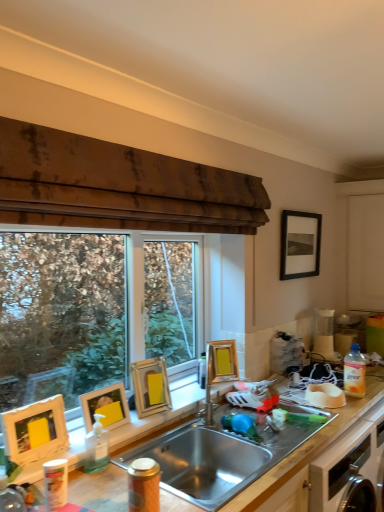
Question: Is white matte cabinet at right positioned with its back to white matte picture frame at left, which appears as the fifth picture frame when viewed from the right?

Choices:
 (A) yes
 (B) no

Answer: (B)

Question: From the image's perspective, would you say white matte cabinet at right is shown under white matte picture frame at left, which appears as the fifth picture frame when viewed from the right?

Choices:
 (A) yes
 (B) no

Answer: (B)

Question: Does white matte cabinet at right have a lesser height compared to white matte picture frame at left, the 5th picture frame viewed from the back?

Choices:
 (A) yes
 (B) no

Answer: (B)

Question: Considering the relative positions of white matte cabinet at right and white matte picture frame at left, which appears as the fifth picture frame when viewed from the right, in the image provided, is white matte cabinet at right behind white matte picture frame at left, which appears as the fifth picture frame when viewed from the right,?

Choices:
 (A) no
 (B) yes

Answer: (B)

Question: Can you confirm if white matte cabinet at right is wider than white matte picture frame at left, which is the first picture frame from front to back?

Choices:
 (A) yes
 (B) no

Answer: (A)

Question: In terms of height, does gold metallic picture frame at upper center, marked as the 2th picture frame in a right-to-left arrangement, look taller or shorter compared to transparent glass window at left?

Choices:
 (A) short
 (B) tall

Answer: (A)

Question: From a real-world perspective, relative to transparent glass window at left, is gold metallic picture frame at upper center, which is the 2th picture frame in top-to-bottom order, vertically above or below?

Choices:
 (A) above
 (B) below

Answer: (B)

Question: From the image's perspective, is gold metallic picture frame at upper center, the fourth picture frame from the front, positioned above or below transparent glass window at left?

Choices:
 (A) above
 (B) below

Answer: (B)

Question: Considering their positions, is gold metallic picture frame at upper center, the fourth picture frame from the front, located in front of or behind transparent glass window at left?

Choices:
 (A) behind
 (B) front

Answer: (A)

Question: Looking at their shapes, would you say gold metallic picture frame at upper center, which is the 2th picture frame in top-to-bottom order, is wider or thinner than matte gold picture frame at upper left, the third picture frame when ordered from back to front?

Choices:
 (A) wide
 (B) thin

Answer: (B)

Question: From a real-world perspective, is gold metallic picture frame at upper center, the 4th picture frame positioned from the left, physically located above or below matte gold picture frame at upper left, acting as the 3th picture frame starting from the left?

Choices:
 (A) above
 (B) below

Answer: (B)

Question: Visually, is gold metallic picture frame at upper center, the second picture frame in the back-to-front sequence, positioned to the left or to the right of matte gold picture frame at upper left, arranged as the third picture frame when viewed from the right?

Choices:
 (A) right
 (B) left

Answer: (A)

Question: Looking at the image, does gold metallic picture frame at upper center, the second picture frame in the back-to-front sequence, seem bigger or smaller compared to matte gold picture frame at upper left, the third picture frame when ordered from back to front?

Choices:
 (A) big
 (B) small

Answer: (B)

Question: In terms of width, does white matte cabinet at right look wider or thinner when compared to stainless steel sink at center?

Choices:
 (A) thin
 (B) wide

Answer: (A)

Question: Considering the positions of point (354, 281) and point (122, 462), is point (354, 281) closer or farther from the camera than point (122, 462)?

Choices:
 (A) farther
 (B) closer

Answer: (A)